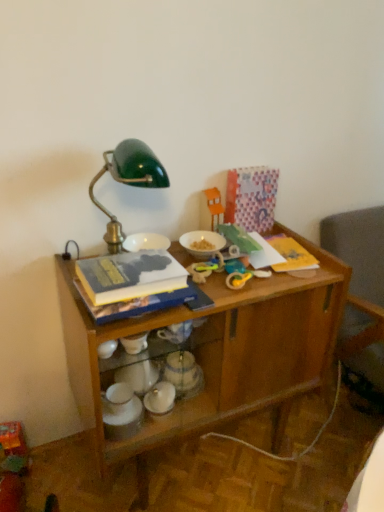
The height and width of the screenshot is (512, 384). In order to click on vacant region below wooden desk at center (from a real-world perspective) in this screenshot , I will do `click(204, 458)`.